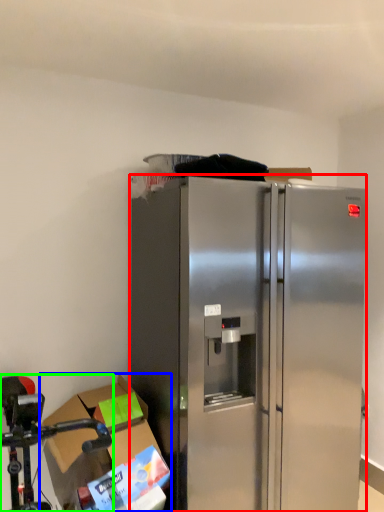
Question: Which object is positioned closest to refrigerator (highlighted by a red box)? Select from cardboard box (highlighted by a blue box) and stainless steel (highlighted by a green box).

Choices:
 (A) cardboard box
 (B) stainless steel

Answer: (A)